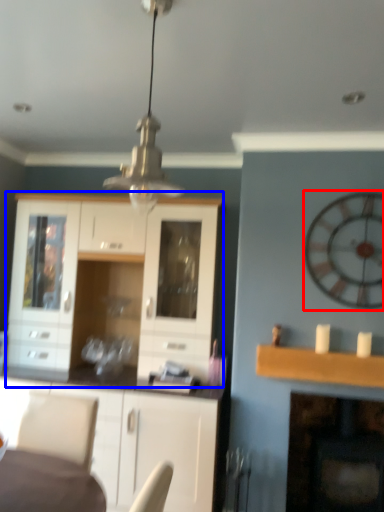
Question: Which object appears closest to the camera in this image, clock (highlighted by a red box) or cabinetry (highlighted by a blue box)?

Choices:
 (A) clock
 (B) cabinetry

Answer: (A)